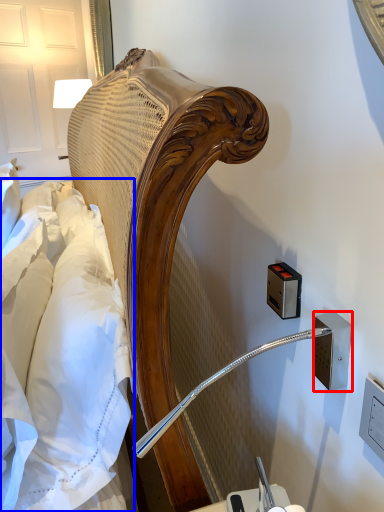
Question: Which object is closer to the camera taking this photo, electric outlet (highlighted by a red box) or sheet (highlighted by a blue box)?

Choices:
 (A) electric outlet
 (B) sheet

Answer: (B)